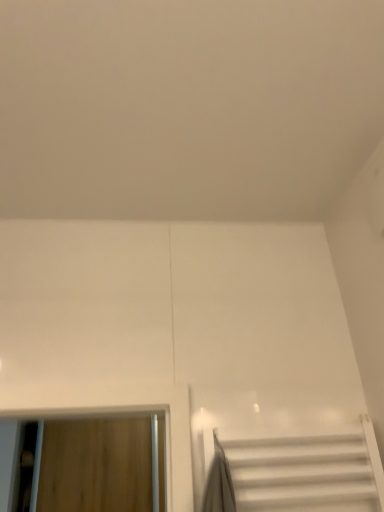
Image resolution: width=384 pixels, height=512 pixels. I want to click on white glossy stairs at lower right, so click(x=303, y=473).

In order to face white glossy stairs at lower right, should I rotate leftwards or rightwards?

A 12.930 degree turn to the right will do.

What do you see at coordinates (303, 473) in the screenshot? I see `white glossy stairs at lower right` at bounding box center [303, 473].

The height and width of the screenshot is (512, 384). In order to click on wooden door at left in this screenshot , I will do `click(86, 465)`.

What do you see at coordinates (86, 465) in the screenshot? This screenshot has width=384, height=512. I see `wooden door at left` at bounding box center [86, 465].

Where is `white glossy stairs at lower right`? This screenshot has height=512, width=384. white glossy stairs at lower right is located at coordinates (303, 473).

Between white glossy stairs at lower right and wooden door at left, which one appears on the left side from the viewer's perspective?

From the viewer's perspective, wooden door at left appears more on the left side.

Which object is further away from the camera taking this photo, white glossy stairs at lower right or wooden door at left?

wooden door at left is more distant.

Between point (257, 443) and point (86, 448), which one is positioned behind?

Point (86, 448)

From the image's perspective, does white glossy stairs at lower right appear higher than wooden door at left?

Yes, from the image's perspective, white glossy stairs at lower right is on top of wooden door at left.

From a real-world perspective, is white glossy stairs at lower right positioned above or below wooden door at left?

white glossy stairs at lower right is below wooden door at left.

Does white glossy stairs at lower right have a greater width compared to wooden door at left?

In fact, white glossy stairs at lower right might be narrower than wooden door at left.

Consider the image. Considering the sizes of objects white glossy stairs at lower right and wooden door at left in the image provided, who is shorter, white glossy stairs at lower right or wooden door at left?

With less height is white glossy stairs at lower right.

Is white glossy stairs at lower right bigger or smaller than wooden door at left?

Clearly, white glossy stairs at lower right is smaller in size than wooden door at left.

Is white glossy stairs at lower right located outside wooden door at left?

Indeed, white glossy stairs at lower right is completely outside wooden door at left.

Is white glossy stairs at lower right beside wooden door at left?

No, white glossy stairs at lower right is not in contact with wooden door at left.

Is white glossy stairs at lower right aimed at wooden door at left?

No.

Find the location of a particular element. window that is above the white glossy stairs at lower right (from a real-world perspective) is located at coordinates (86, 465).

Can you confirm if wooden door at left is positioned to the left of white glossy stairs at lower right?

Yes, wooden door at left is to the left of white glossy stairs at lower right.

Considering the positions of objects wooden door at left and white glossy stairs at lower right in the image provided, who is behind, wooden door at left or white glossy stairs at lower right?

Positioned behind is wooden door at left.

Does point (53, 434) lie behind point (303, 439)?

Yes, point (53, 434) is behind point (303, 439).

From the image's perspective, is wooden door at left located above or below white glossy stairs at lower right?

Clearly, from the image's perspective, wooden door at left is below white glossy stairs at lower right.

From a real-world perspective, is wooden door at left on white glossy stairs at lower right?

Indeed, from a real-world perspective, wooden door at left stands above white glossy stairs at lower right.

Which object is wider, wooden door at left or white glossy stairs at lower right?

Wider between the two is wooden door at left.

Considering the relative sizes of wooden door at left and white glossy stairs at lower right in the image provided, is wooden door at left taller than white glossy stairs at lower right?

Yes, wooden door at left is taller than white glossy stairs at lower right.

Is wooden door at left smaller than white glossy stairs at lower right?

Incorrect, wooden door at left is not smaller in size than white glossy stairs at lower right.

Is white glossy stairs at lower right completely or partially inside wooden door at left?

That's incorrect, white glossy stairs at lower right is not inside wooden door at left.

Is wooden door at left not close to white glossy stairs at lower right?

Yes, wooden door at left and white glossy stairs at lower right are quite far apart.

Is wooden door at left oriented away from white glossy stairs at lower right?

No, wooden door at left is not facing the opposite direction of white glossy stairs at lower right.

This screenshot has height=512, width=384. Find the location of `stairs in front of the wooden door at left`. stairs in front of the wooden door at left is located at coordinates (303, 473).

Locate an element on the screen. The height and width of the screenshot is (512, 384). stairs in front of the wooden door at left is located at coordinates (303, 473).

The image size is (384, 512). In the image, there is a wooden door at left. Identify the location of stairs below it (from a real-world perspective). (303, 473).